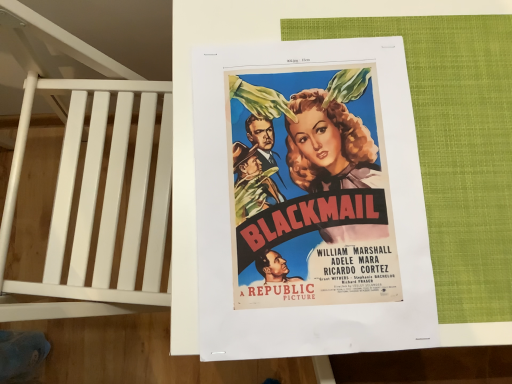
What do you see at coordinates (309, 201) in the screenshot? I see `matte paper poster at center` at bounding box center [309, 201].

Identify the location of matte paper poster at center. The image size is (512, 384). (309, 201).

Where is `matte paper poster at center`? matte paper poster at center is located at coordinates (309, 201).